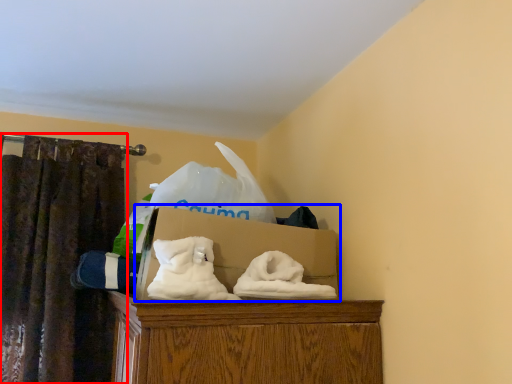
Question: Which object is closer to the camera taking this photo, curtain (highlighted by a red box) or box (highlighted by a blue box)?

Choices:
 (A) curtain
 (B) box

Answer: (B)